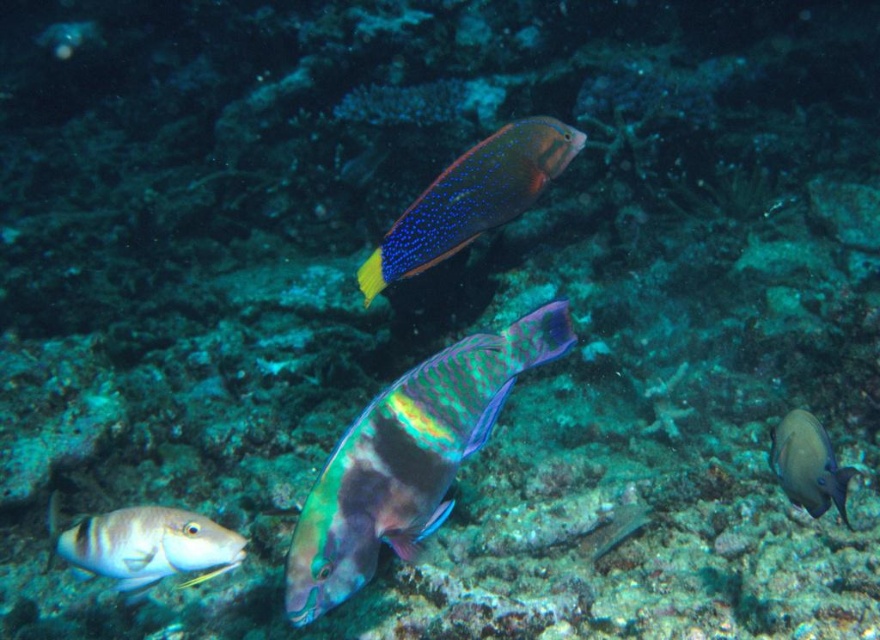
You are a marine biologist observing the underwater scene. You need to determine which fish has a wider body between the shiny iridescent fish at center and the shiny blue and yellow fish at upper center. Based on the spatial information provided, can you identify which one is wider?

The shiny iridescent fish at center is wider than the shiny blue and yellow fish at upper center according to the description provided.

You are a marine biologist observing an underwater scene. You notice a shiny iridescent fish at center and a point marked at coordinates (408,458). Can you determine if the shiny iridescent fish at center is located at that point?

The shiny iridescent fish at center is represented by point (408,458), so yes, the shiny iridescent fish at center is located at that point.

You are a marine biologist observing the underwater scene. You need to determine if a 24 inch robotic submarine can safely navigate between the shiny iridescent fish at center and the shiny silver fish at lower left without touching either. Can it?

The distance between the shiny iridescent fish at center and the shiny silver fish at lower left is 26.05 inches. Since the robotic submarine is 24 inches long, it can safely pass through the space between them as the distance is greater than the submarine length.